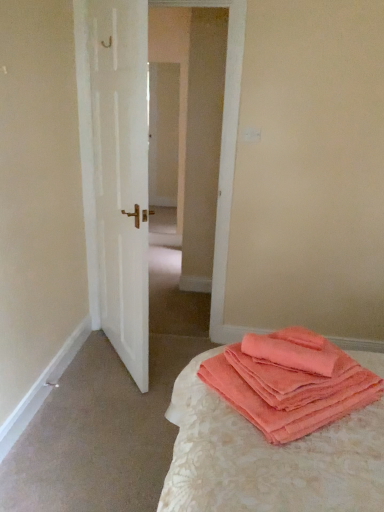
Question: Is white matte door at left positioned far away from coral fleece towels at lower right?

Choices:
 (A) no
 (B) yes

Answer: (B)

Question: Does white matte door at left have a smaller size compared to coral fleece towels at lower right?

Choices:
 (A) no
 (B) yes

Answer: (A)

Question: From a real-world perspective, is white matte door at left positioned over coral fleece towels at lower right based on gravity?

Choices:
 (A) no
 (B) yes

Answer: (B)

Question: Is white matte door at left thinner than coral fleece towels at lower right?

Choices:
 (A) no
 (B) yes

Answer: (B)

Question: Could you tell me if white matte door at left is turned towards coral fleece towels at lower right?

Choices:
 (A) no
 (B) yes

Answer: (A)

Question: Does point (322, 352) appear closer or farther from the camera than point (382, 458)?

Choices:
 (A) closer
 (B) farther

Answer: (B)

Question: From the image's perspective, relative to coral terry cloth towels at lower right, is coral fleece towels at lower right above or below?

Choices:
 (A) above
 (B) below

Answer: (A)

Question: Visually, is coral fleece towels at lower right positioned to the left or to the right of coral terry cloth towels at lower right?

Choices:
 (A) left
 (B) right

Answer: (A)

Question: Is coral fleece towels at lower right in front of or behind coral terry cloth towels at lower right in the image?

Choices:
 (A) behind
 (B) front

Answer: (A)

Question: From the image's perspective, is white matte door at left above or below coral terry cloth towels at lower right?

Choices:
 (A) above
 (B) below

Answer: (A)

Question: Is white matte door at left to the left or to the right of coral terry cloth towels at lower right in the image?

Choices:
 (A) left
 (B) right

Answer: (A)

Question: Is point (145, 384) positioned closer to the camera than point (296, 462)?

Choices:
 (A) farther
 (B) closer

Answer: (A)

Question: Considering their positions, is white matte door at left located in front of or behind coral terry cloth towels at lower right?

Choices:
 (A) behind
 (B) front

Answer: (A)

Question: Is coral terry cloth towels at lower right to the left or to the right of coral fleece towels at lower right in the image?

Choices:
 (A) left
 (B) right

Answer: (B)

Question: Is point (190, 367) closer or farther from the camera than point (322, 366)?

Choices:
 (A) closer
 (B) farther

Answer: (B)